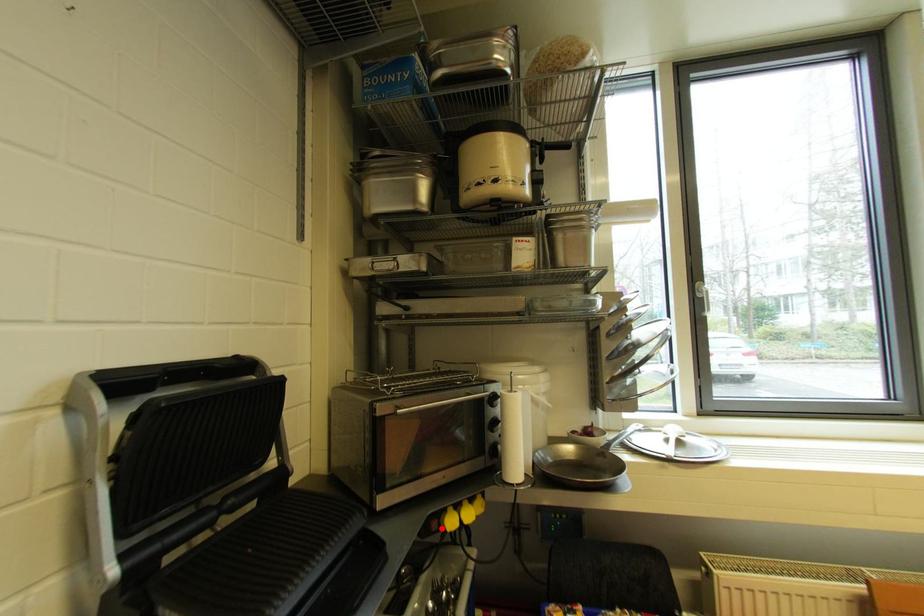
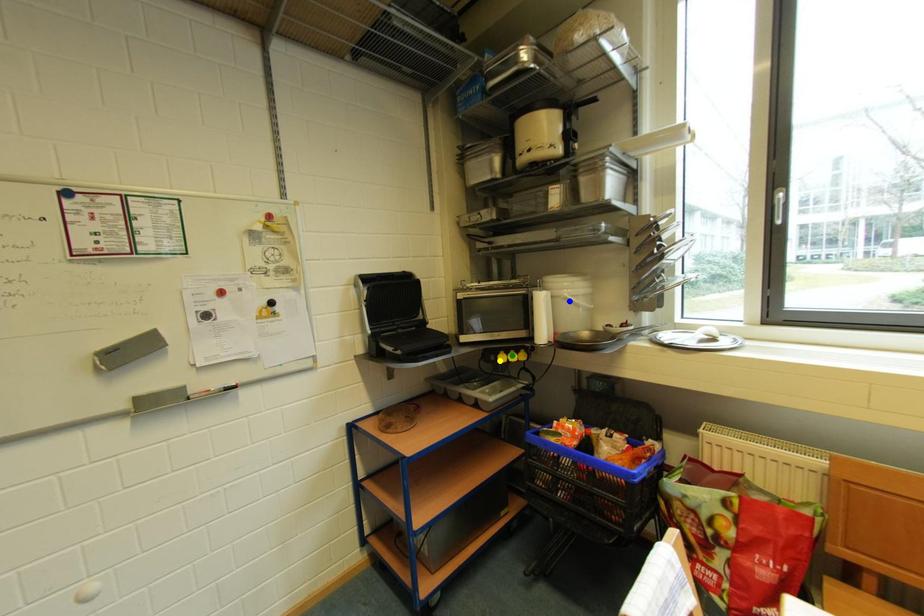
Question: I am providing you with two images of the same scene from different viewpoints. A red point is marked on the first image. You are given multiple points on the second image. Which point in image 2 represents the same 3d spot as the red point in image 1?

Choices:
 (A) yellow point
 (B) green point
 (C) blue point

Answer: (A)